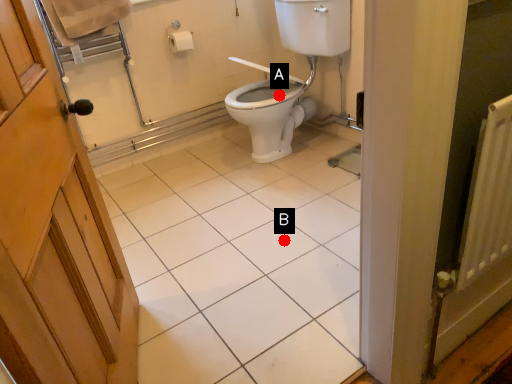
Question: Two points are circled on the image, labeled by A and B beside each circle. Which point is closer to the camera taking this photo?

Choices:
 (A) A is closer
 (B) B is closer

Answer: (B)